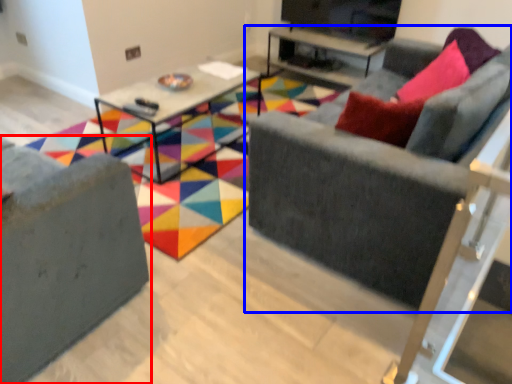
Question: Which point is further to the camera, studio couch (highlighted by a red box) or studio couch (highlighted by a blue box)?

Choices:
 (A) studio couch
 (B) studio couch

Answer: (B)